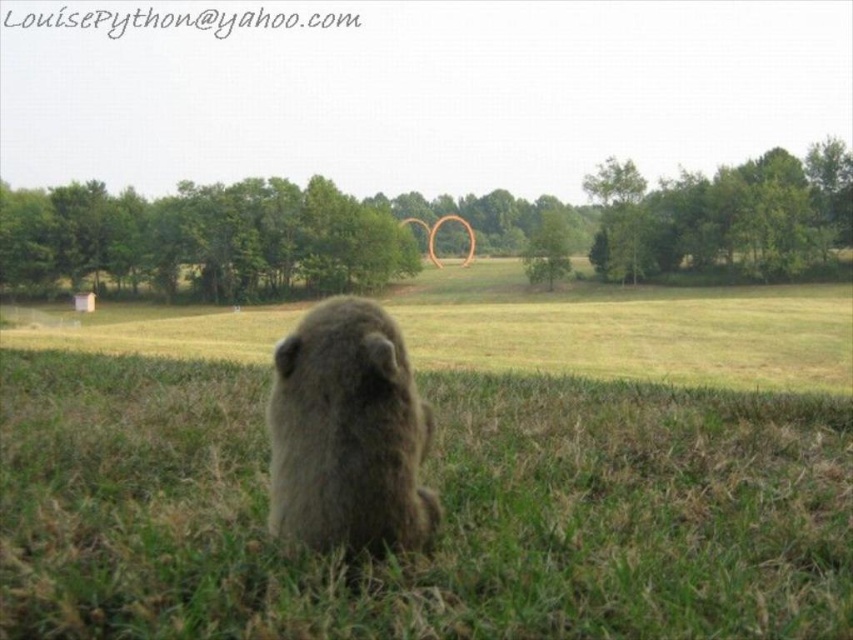
Is green grass at center positioned behind fuzzy brown groundhog at center?

No, green grass at center is in front of fuzzy brown groundhog at center.

Between green grass at center and fuzzy brown groundhog at center, which one is positioned lower?

green grass at center is below.

Identify the location of green grass at center. (444, 509).

Where is `green grass at center`? This screenshot has width=853, height=640. green grass at center is located at coordinates (444, 509).